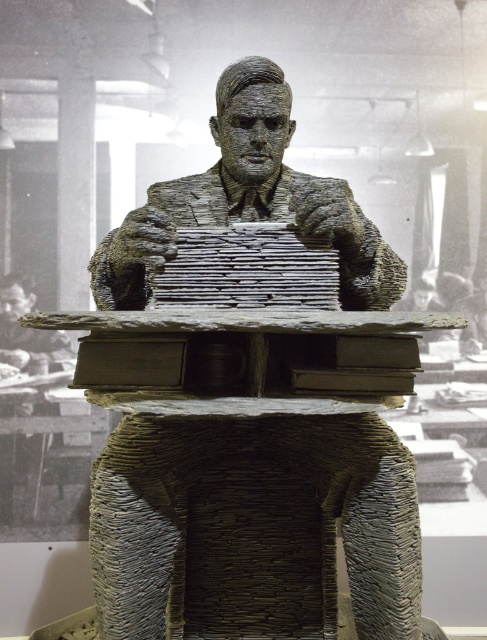
You are an art curator planning to display the rustic stone table at center and the rustic stone statue at center in a gallery. Given their sizes, which object should be placed closer to the entrance to ensure visitors can easily view both without obstruction?

The rustic stone table at center is larger in size than the rustic stone statue at center. To ensure both are visible without obstruction, the larger rustic stone table at center should be placed closer to the entrance so visitors can see it first, while the smaller statue can be positioned behind it or to the side for better visibility.

You are an art student analyzing the sculpture. You notice the rustic stone table at center and the rustic stone statue at center. Based on their positions, which object is placed lower in the image?

The rustic stone table at center is located below the rustic stone statue at center, so it is placed lower in the image.